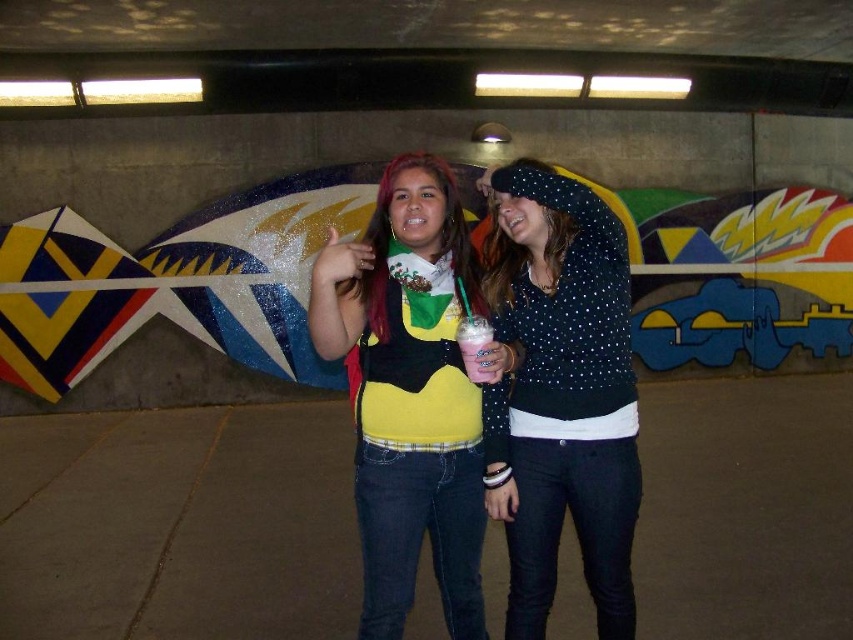
Based on the photo, you are a fashion designer observing two people wearing sweaters in the image. The first person is wearing a polka dot sweater at center and the second is wearing a matte yellow sweater at center. You need to place a rack between them to display your new collection. How far apart should you position the rack from each sweater to ensure it is equidistant from both?

The distance between the polka dot sweater at center and the matte yellow sweater at center is 10.68 inches. To place the rack equidistant from both, position it 5.34 inches away from each sweater.